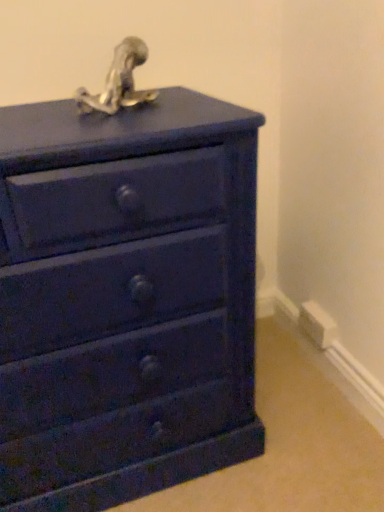
Question: Is metallic silver sculpture at top with white plastic electric outlet at lower right?

Choices:
 (A) no
 (B) yes

Answer: (A)

Question: Is metallic silver sculpture at top looking in the opposite direction of white plastic electric outlet at lower right?

Choices:
 (A) yes
 (B) no

Answer: (B)

Question: From the image's perspective, is metallic silver sculpture at top located above white plastic electric outlet at lower right?

Choices:
 (A) no
 (B) yes

Answer: (B)

Question: From the image's perspective, is metallic silver sculpture at top beneath white plastic electric outlet at lower right?

Choices:
 (A) no
 (B) yes

Answer: (A)

Question: Can you confirm if metallic silver sculpture at top is shorter than white plastic electric outlet at lower right?

Choices:
 (A) yes
 (B) no

Answer: (B)

Question: Would you say metallic silver sculpture at top is outside white plastic electric outlet at lower right?

Choices:
 (A) yes
 (B) no

Answer: (A)

Question: Can you confirm if matte blue chest of drawers at center is bigger than metallic silver sculpture at top?

Choices:
 (A) yes
 (B) no

Answer: (A)

Question: Would you consider matte blue chest of drawers at center to be distant from metallic silver sculpture at top?

Choices:
 (A) yes
 (B) no

Answer: (B)

Question: From the image's perspective, is matte blue chest of drawers at center below metallic silver sculpture at top?

Choices:
 (A) no
 (B) yes

Answer: (B)

Question: Does matte blue chest of drawers at center have a smaller size compared to metallic silver sculpture at top?

Choices:
 (A) no
 (B) yes

Answer: (A)

Question: Is matte blue chest of drawers at center oriented towards metallic silver sculpture at top?

Choices:
 (A) yes
 (B) no

Answer: (B)

Question: Does matte blue chest of drawers at center have a lesser height compared to metallic silver sculpture at top?

Choices:
 (A) yes
 (B) no

Answer: (B)

Question: Is the surface of metallic silver sculpture at top in direct contact with matte blue chest of drawers at center?

Choices:
 (A) no
 (B) yes

Answer: (A)